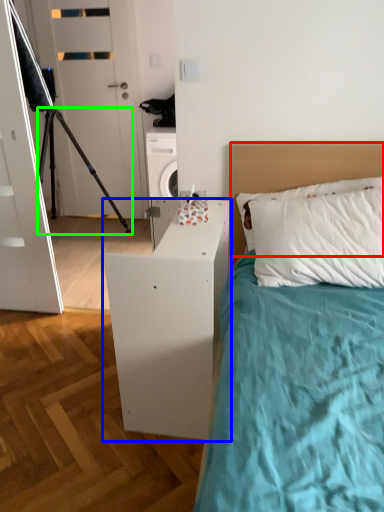
Question: Which object is the closest to the headboard (highlighted by a red box)? Choose among these: nightstand (highlighted by a blue box) or tripod (highlighted by a green box).

Choices:
 (A) nightstand
 (B) tripod

Answer: (A)